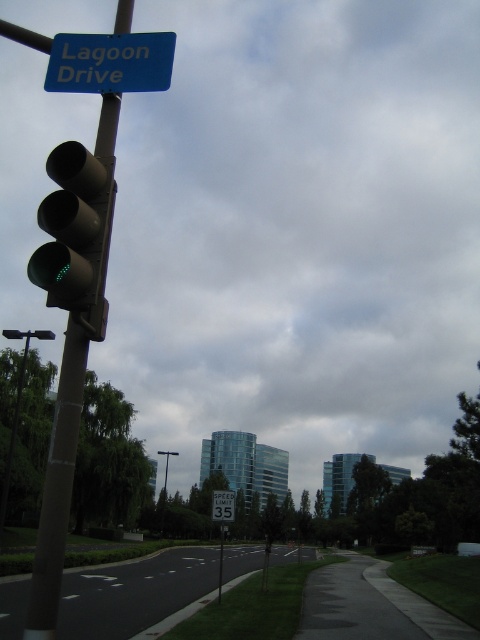
Based on the photo, you are standing at the intersection and see the point marked at coordinates [110,61]. What object is located at that point?

The point at coordinates [110,61] corresponds to the blue plastic sign at upper center.

You are a pedestrian standing at the point with coordinates point [166,497]. You want to walk to the point with coordinates point [228,506]. According to the scene, which direction should you move relative to the traffic light?

The point [228,506] is in front of the point [166,497], so you should move forward towards the traffic light.

In the scene shown: You are a pedestrian standing on the sidewalk on the right side of the road. You notice the blue plastic sign at upper center and the metallic pole at left. Which object is closer to your eye level?

The blue plastic sign at upper center is shorter than the metallic pole at left, so the blue plastic sign at upper center is closer to your eye level.